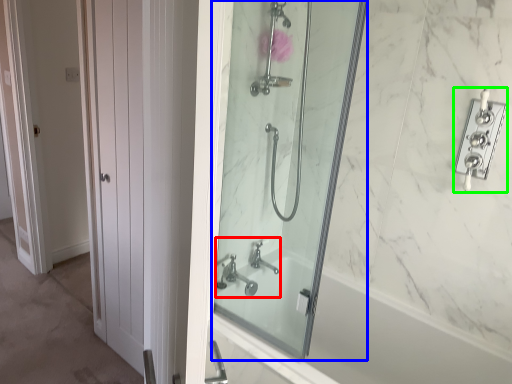
Question: Based on their relative distances, which object is farther from sink (highlighted by a red box)? Choose from mirror (highlighted by a blue box) and lock (highlighted by a green box).

Choices:
 (A) mirror
 (B) lock

Answer: (B)